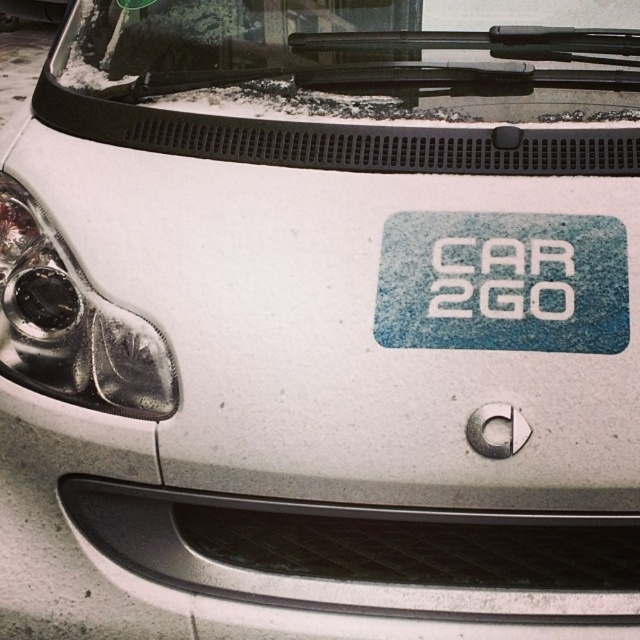
Can you confirm if transparent glass windshield at upper center is bigger than blue textured sticker at center?

Correct, transparent glass windshield at upper center is larger in size than blue textured sticker at center.

Between point (564, 35) and point (429, 216), which one is positioned behind?

Positioned behind is point (564, 35).

Locate an element on the screen. transparent glass windshield at upper center is located at coordinates (333, 61).